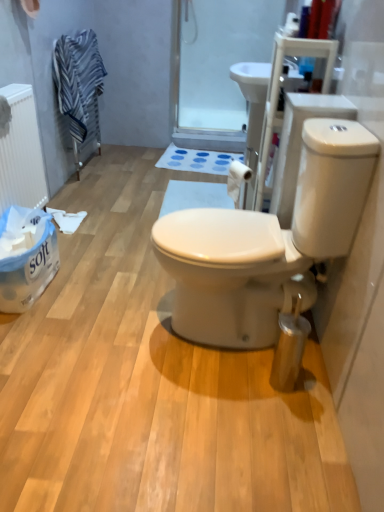
Question: Could you tell me if striped fabric towel at upper left is turned towards white matte radiator at left?

Choices:
 (A) no
 (B) yes

Answer: (A)

Question: Does striped fabric towel at upper left contain white matte radiator at left?

Choices:
 (A) yes
 (B) no

Answer: (B)

Question: From the image's perspective, is striped fabric towel at upper left below white matte radiator at left?

Choices:
 (A) yes
 (B) no

Answer: (B)

Question: Is the position of striped fabric towel at upper left more distant than that of white matte radiator at left?

Choices:
 (A) yes
 (B) no

Answer: (A)

Question: From a real-world perspective, is striped fabric towel at upper left physically below white matte radiator at left?

Choices:
 (A) yes
 (B) no

Answer: (B)

Question: Considering the positions of white glossy toilet at center and transparent plastic screen door at upper center in the image, is white glossy toilet at center bigger or smaller than transparent plastic screen door at upper center?

Choices:
 (A) small
 (B) big

Answer: (B)

Question: In terms of height, does white glossy toilet at center look taller or shorter compared to transparent plastic screen door at upper center?

Choices:
 (A) tall
 (B) short

Answer: (B)

Question: In terms of width, does white glossy toilet at center look wider or thinner when compared to transparent plastic screen door at upper center?

Choices:
 (A) thin
 (B) wide

Answer: (B)

Question: From the image's perspective, is white glossy toilet at center located above or below transparent plastic screen door at upper center?

Choices:
 (A) above
 (B) below

Answer: (B)

Question: Considering the positions of striped fabric towel at upper left and transparent plastic screen door at upper center in the image, is striped fabric towel at upper left bigger or smaller than transparent plastic screen door at upper center?

Choices:
 (A) big
 (B) small

Answer: (A)

Question: Do you think striped fabric towel at upper left is within transparent plastic screen door at upper center, or outside of it?

Choices:
 (A) inside
 (B) outside

Answer: (B)

Question: Considering the relative positions of striped fabric towel at upper left and transparent plastic screen door at upper center in the image provided, is striped fabric towel at upper left to the left or to the right of transparent plastic screen door at upper center?

Choices:
 (A) right
 (B) left

Answer: (B)

Question: From their relative heights in the image, would you say striped fabric towel at upper left is taller or shorter than transparent plastic screen door at upper center?

Choices:
 (A) tall
 (B) short

Answer: (B)

Question: Would you say white matte toilet paper at center is to the left or to the right of blue fabric bath mat at center in the picture?

Choices:
 (A) left
 (B) right

Answer: (B)

Question: Considering the positions of point (241, 177) and point (206, 167), is point (241, 177) closer or farther from the camera than point (206, 167)?

Choices:
 (A) closer
 (B) farther

Answer: (A)